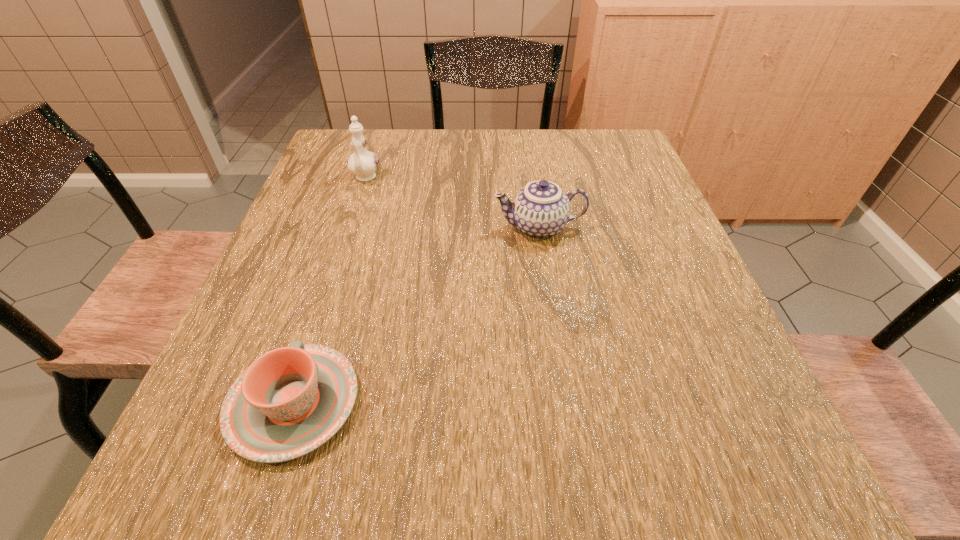
I want to click on unoccupied area between the second shortest object and the tallest object, so click(x=452, y=203).

Find the location of a particular element. free space that is in between the tallest chinaware and the shortest object is located at coordinates (x=329, y=291).

I want to click on object that is the second closest to the farthest chinaware, so click(290, 401).

Identify which object is located as the second nearest to the nearest object. Please provide its 2D coordinates. Your answer should be formatted as a tuple, i.e. [(x, y)], where the tuple contains the x and y coordinates of a point satisfying the conditions above.

[(363, 163)]

The width and height of the screenshot is (960, 540). I want to click on the second closest chinaware to the rightmost chinaware, so click(x=290, y=401).

Image resolution: width=960 pixels, height=540 pixels. I want to click on the second closest chinaware relative to the shortest chinaware, so click(363, 163).